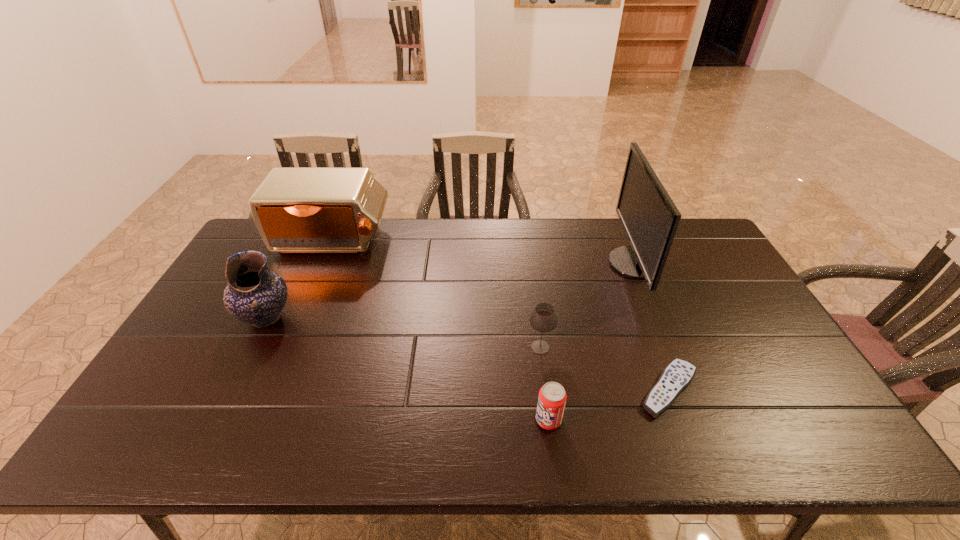
Find the location of `free spot that satisfies the following two spatial constraints: 1. on the front side of the pottery; 2. on the right side of the shortest object`. free spot that satisfies the following two spatial constraints: 1. on the front side of the pottery; 2. on the right side of the shortest object is located at coordinates (230, 390).